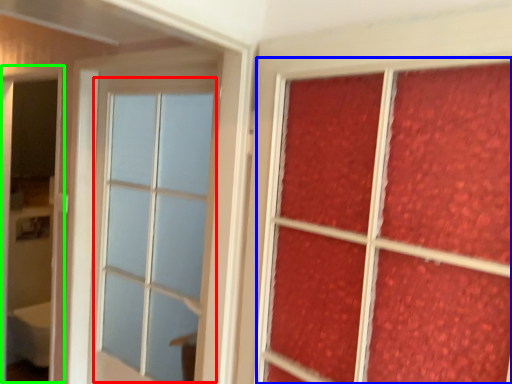
Question: Based on their relative distances, which object is nearer to glass window (highlighted by a red box)? Choose from bay window (highlighted by a blue box) and screen door (highlighted by a green box).

Choices:
 (A) bay window
 (B) screen door

Answer: (B)